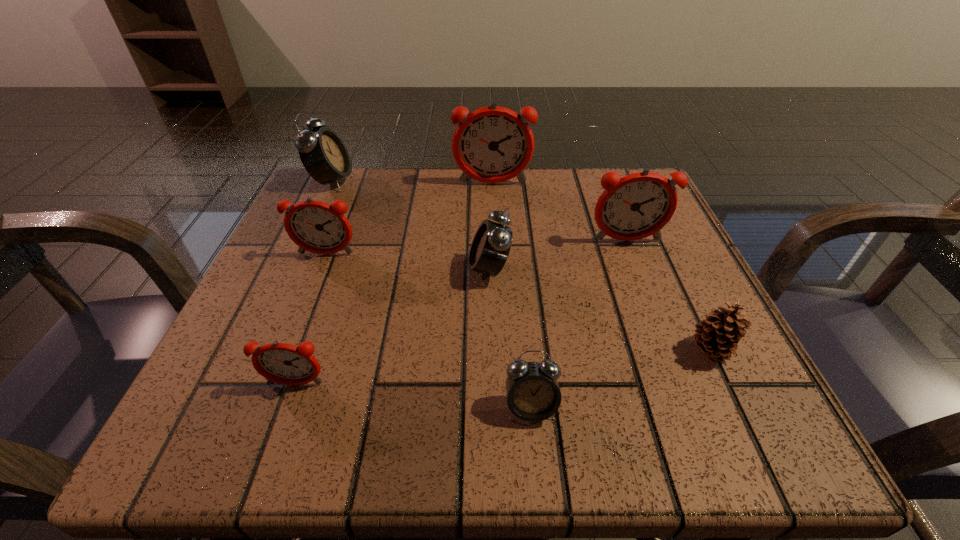
Locate an element on the screen. The image size is (960, 540). blank region between the smallest reddish-pink alarm clock and the third nearest object is located at coordinates (503, 367).

I want to click on free space that is in between the smallest white alarm clock and the second biggest white alarm clock, so click(510, 339).

Where is `vacant area that lies between the biggest white alarm clock and the second smallest white alarm clock`? vacant area that lies between the biggest white alarm clock and the second smallest white alarm clock is located at coordinates (411, 226).

Find the location of `unoccupied position between the tallest alarm clock and the pinecone`. unoccupied position between the tallest alarm clock and the pinecone is located at coordinates (602, 267).

Find the location of a particular element. free space that is in between the leftmost white alarm clock and the smallest reddish-pink alarm clock is located at coordinates (314, 282).

In order to click on vacant area between the second biggest white alarm clock and the nearest reddish-pink alarm clock in this screenshot , I will do `click(393, 327)`.

Find the location of `free point between the leftmost white alarm clock and the pinecone`. free point between the leftmost white alarm clock and the pinecone is located at coordinates (521, 266).

At what (x,y) coordinates should I click in order to perform the action: click on object that stands as the fifth closest to the nearest reddish-pink alarm clock. Please return your answer as a coordinate pair (x, y). The height and width of the screenshot is (540, 960). Looking at the image, I should click on (639, 205).

Choose which object is the sixth nearest neighbor to the second smallest white alarm clock. Please provide its 2D coordinates. Your answer should be formatted as a tuple, i.e. [(x, y)], where the tuple contains the x and y coordinates of a point satisfying the conditions above.

[(717, 336)]

Select which alarm clock is the third closest to the nearest white alarm clock. Please provide its 2D coordinates. Your answer should be formatted as a tuple, i.e. [(x, y)], where the tuple contains the x and y coordinates of a point satisfying the conditions above.

[(639, 205)]